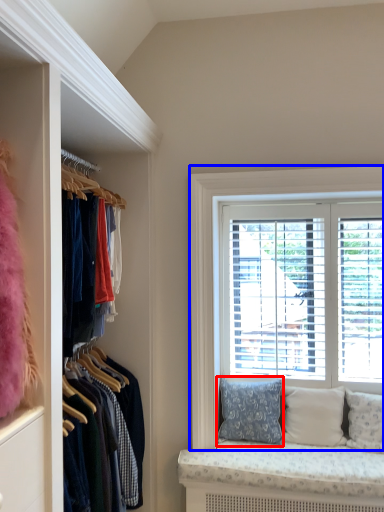
Question: Which object is further to the camera taking this photo, pillow (highlighted by a red box) or window (highlighted by a blue box)?

Choices:
 (A) pillow
 (B) window

Answer: (B)